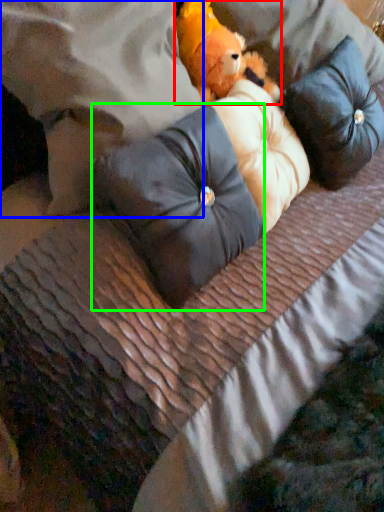
Question: Considering the real-world distances, which object is farthest from teddy bear (highlighted by a red box)? pillow (highlighted by a blue box) or pillow (highlighted by a green box)?

Choices:
 (A) pillow
 (B) pillow

Answer: (B)